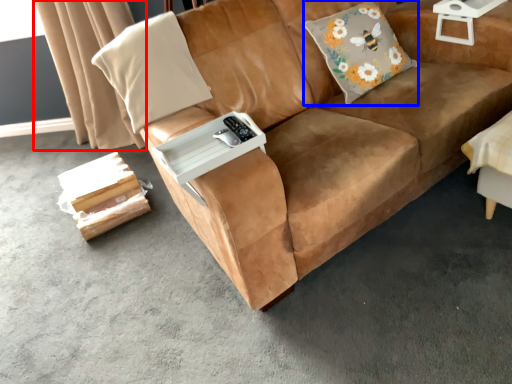
Question: Among these objects, which one is nearest to the camera, curtain (highlighted by a red box) or throw pillow (highlighted by a blue box)?

Choices:
 (A) curtain
 (B) throw pillow

Answer: (B)